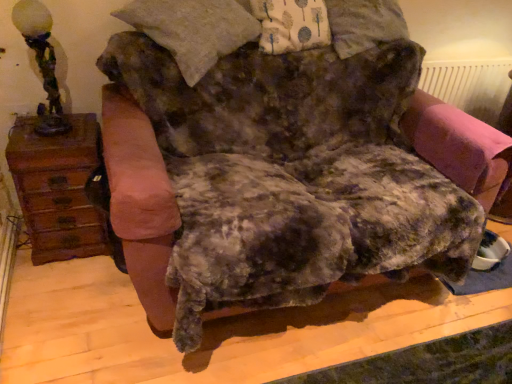
Question: From the image's perspective, is pink fabric swivel chair at right under antique bronze lamp at left?

Choices:
 (A) no
 (B) yes

Answer: (B)

Question: Would you say pink fabric swivel chair at right contains antique bronze lamp at left?

Choices:
 (A) yes
 (B) no

Answer: (B)

Question: Is pink fabric swivel chair at right closer to camera compared to antique bronze lamp at left?

Choices:
 (A) no
 (B) yes

Answer: (A)

Question: From a real-world perspective, does pink fabric swivel chair at right stand above antique bronze lamp at left?

Choices:
 (A) no
 (B) yes

Answer: (A)

Question: Are pink fabric swivel chair at right and antique bronze lamp at left located far from each other?

Choices:
 (A) yes
 (B) no

Answer: (A)

Question: Is pink fabric swivel chair at right to the right of antique bronze lamp at left from the viewer's perspective?

Choices:
 (A) yes
 (B) no

Answer: (A)

Question: Is brown wood dresser at left at the left side of pink plastic radiator at upper right?

Choices:
 (A) yes
 (B) no

Answer: (A)

Question: Is pink plastic radiator at upper right at the back of brown wood dresser at left?

Choices:
 (A) yes
 (B) no

Answer: (B)

Question: From the image's perspective, is brown wood dresser at left located above pink plastic radiator at upper right?

Choices:
 (A) no
 (B) yes

Answer: (A)

Question: From a real-world perspective, is brown wood dresser at left beneath pink plastic radiator at upper right?

Choices:
 (A) no
 (B) yes

Answer: (B)

Question: Is brown wood dresser at left wider than pink plastic radiator at upper right?

Choices:
 (A) no
 (B) yes

Answer: (B)

Question: Can you confirm if brown wood dresser at left is taller than pink plastic radiator at upper right?

Choices:
 (A) no
 (B) yes

Answer: (B)

Question: Considering the relative positions of pink plastic radiator at upper right and antique bronze lamp at left in the image provided, is pink plastic radiator at upper right to the right of antique bronze lamp at left from the viewer's perspective?

Choices:
 (A) yes
 (B) no

Answer: (A)